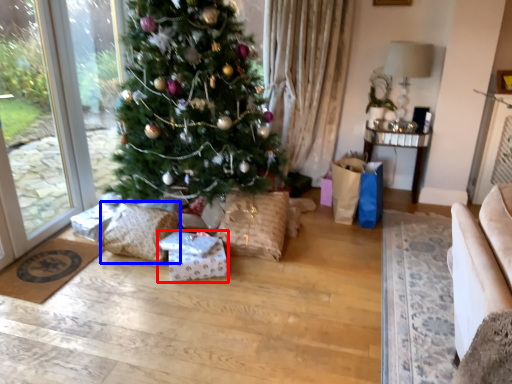
Question: Which object is further to the camera taking this photo, package (highlighted by a red box) or pillow (highlighted by a blue box)?

Choices:
 (A) package
 (B) pillow

Answer: (B)